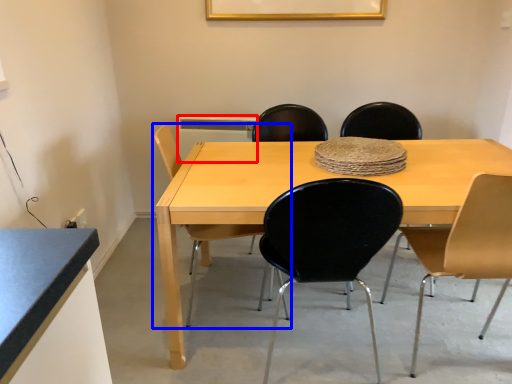
Question: Which of the following is the closest to the observer, appliance (highlighted by a red box) or chair (highlighted by a blue box)?

Choices:
 (A) appliance
 (B) chair

Answer: (B)